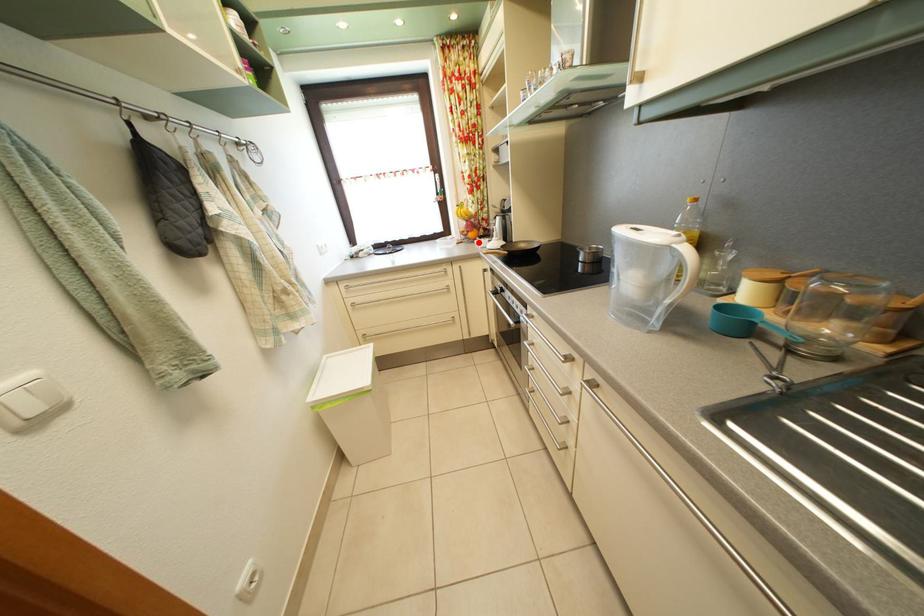
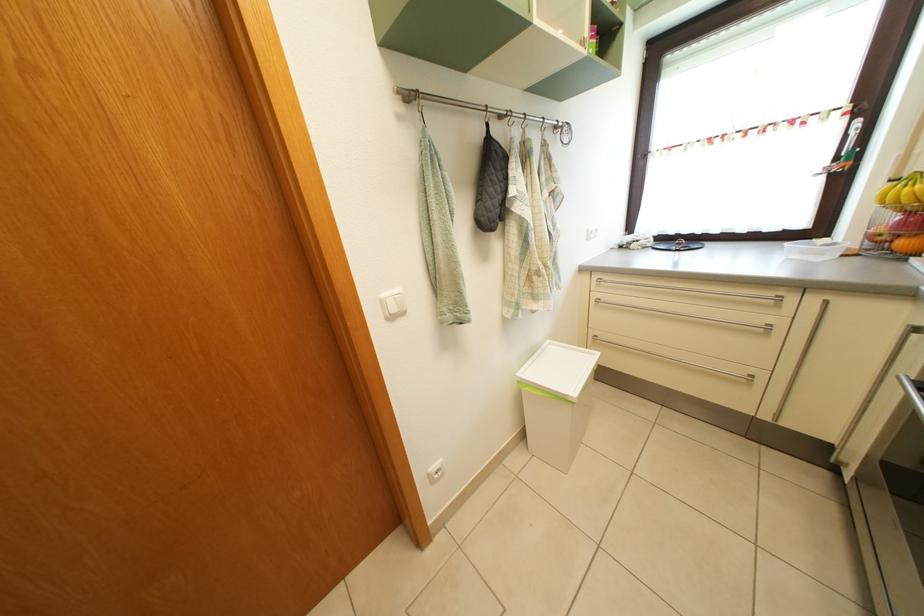
Question: I am providing you with two images of the same scene from different viewpoints. In image1, a red point is highlighted. Considering the same 3D point in image2, which of the following is correct?

Choices:
 (A) It is closer
 (B) It is farther

Answer: (B)